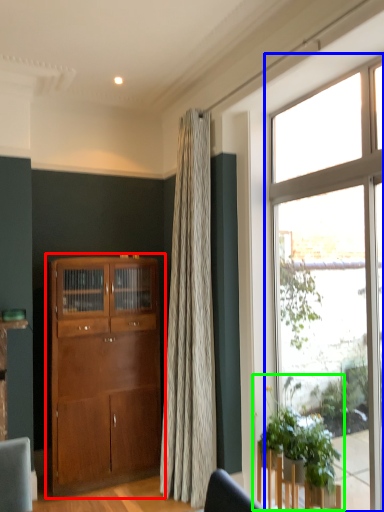
Question: Based on their relative distances, which object is farther from cabinetry (highlighted by a red box)? Choose from window (highlighted by a blue box) and houseplant (highlighted by a green box).

Choices:
 (A) window
 (B) houseplant

Answer: (A)